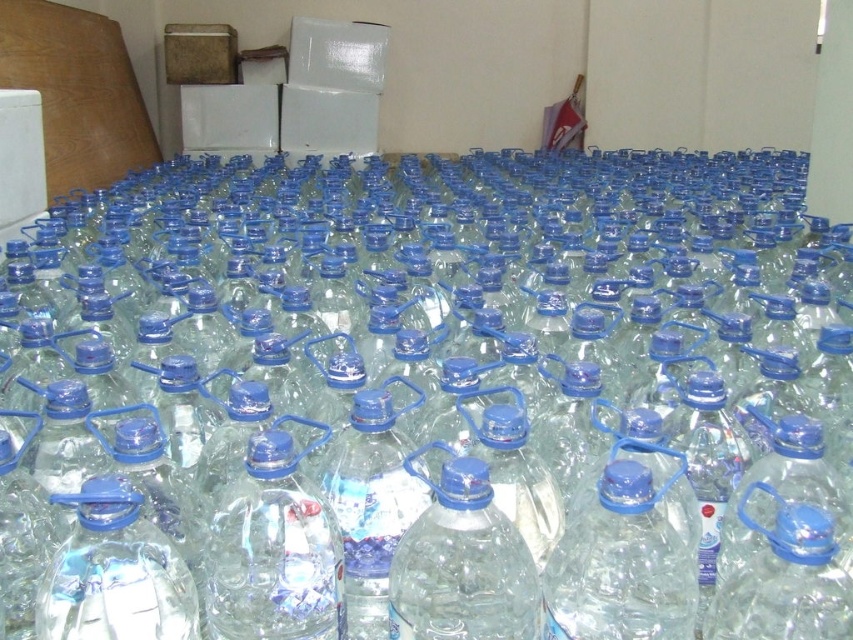
You are organizing a picnic and need to know which bottle is directly below the other. You have two bottles in the scene, the clear plastic bottle at center and the transparent plastic bottle at center. Which one is located underneath the other?

The clear plastic bottle at center is positioned under the transparent plastic bottle at center, so it is located underneath the other bottle.

You are organizing the bottles on the table and need to place a new bottle between the clear plastic bottle at center and the transparent plastic bottle at center. Where should you place it?

You should place the new bottle to the right of the clear plastic bottle at center and to the left of the transparent plastic bottle at center since the clear plastic bottle at center is to the left of the transparent plastic bottle at center.